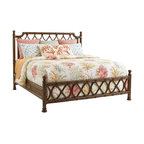
This screenshot has height=144, width=144. I want to click on you pull the covers down here to get in the bed, so [x=27, y=60].